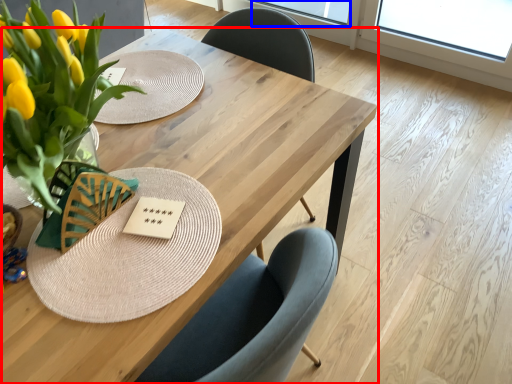
Question: Among these objects, which one is nearest to the camera, table (highlighted by a red box) or window screen (highlighted by a blue box)?

Choices:
 (A) table
 (B) window screen

Answer: (A)